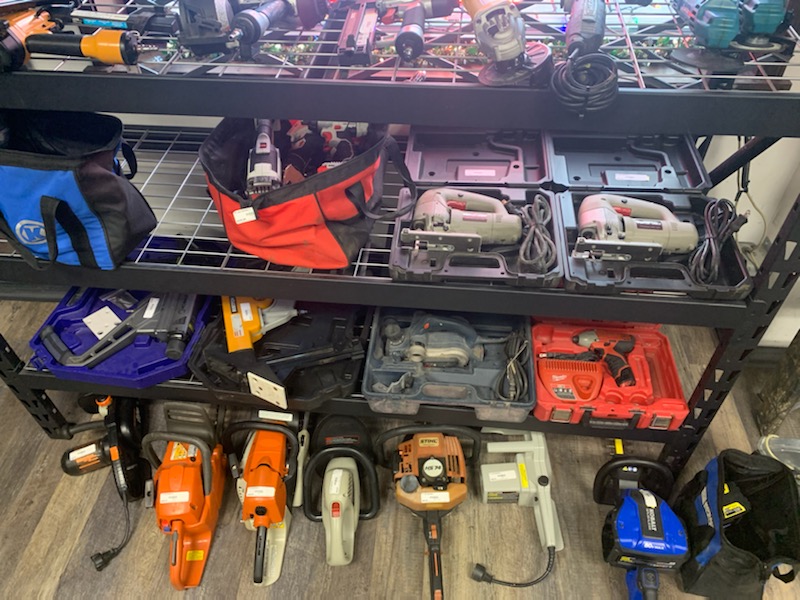
Where is `light reflection on rack`? light reflection on rack is located at coordinates (620, 11).